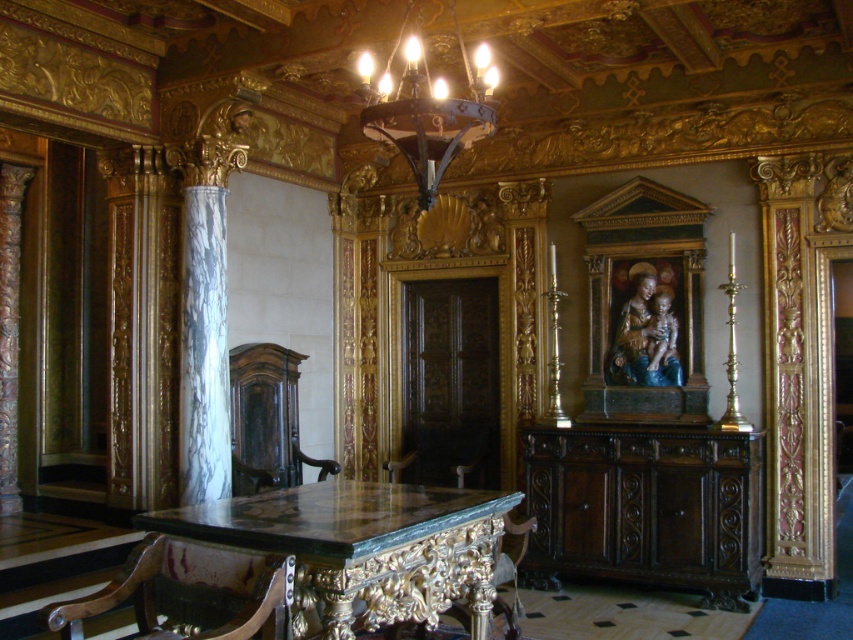
Is wooden polished chair at lower left positioned before dark bronze chandelier at upper center?

Yes, it is.

Can you confirm if wooden polished chair at lower left is shorter than dark bronze chandelier at upper center?

Yes, wooden polished chair at lower left is shorter than dark bronze chandelier at upper center.

Does point (161, 586) come behind point (426, 161)?

Yes, point (161, 586) is farther from viewer.

Image resolution: width=853 pixels, height=640 pixels. I want to click on wooden polished chair at lower left, so click(x=189, y=593).

Can you confirm if wooden polished chair at lower left is smaller than dark wood chair at left?

Correct, wooden polished chair at lower left occupies less space than dark wood chair at left.

Locate an element on the screen. wooden polished chair at lower left is located at coordinates (189, 593).

This screenshot has height=640, width=853. What are the coordinates of `wooden polished chair at lower left` in the screenshot? It's located at 189,593.

Is the position of wooden polished chair at lower left more distant than that of green marble chair at lower center?

No, it is in front of green marble chair at lower center.

Which is in front, point (231, 612) or point (469, 618)?

Point (231, 612)

Locate an element on the screen. The width and height of the screenshot is (853, 640). wooden polished chair at lower left is located at coordinates (189, 593).